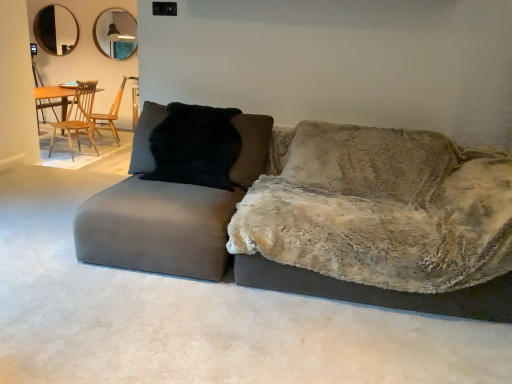
Question: In which direction should I rotate to look at wooden chair at center, the first chair from the back?

Choices:
 (A) left
 (B) right

Answer: (A)

Question: Considering the relative positions of matte silver mirror at upper center, the 1th mirror in the right-to-left sequence, and velvet gray couch at center in the image provided, is matte silver mirror at upper center, the 1th mirror in the right-to-left sequence, in front of velvet gray couch at center?

Choices:
 (A) no
 (B) yes

Answer: (A)

Question: Is matte silver mirror at upper center, arranged as the 2th mirror when viewed from the left, to the left of velvet gray couch at center from the viewer's perspective?

Choices:
 (A) no
 (B) yes

Answer: (B)

Question: Does matte silver mirror at upper center, arranged as the 2th mirror when viewed from the left, have a lesser height compared to velvet gray couch at center?

Choices:
 (A) no
 (B) yes

Answer: (A)

Question: Is matte silver mirror at upper center, arranged as the 2th mirror when viewed from the left, turned away from velvet gray couch at center?

Choices:
 (A) no
 (B) yes

Answer: (A)

Question: From the image's perspective, does matte silver mirror at upper center, arranged as the 2th mirror when viewed from the left, appear higher than velvet gray couch at center?

Choices:
 (A) no
 (B) yes

Answer: (B)

Question: Are matte silver mirror at upper center, arranged as the 2th mirror when viewed from the left, and velvet gray couch at center far apart?

Choices:
 (A) no
 (B) yes

Answer: (B)

Question: Does black glass mirror at upper left, the 2th mirror when ordered from right to left, have a lesser width compared to matte gray swivel chair at left?

Choices:
 (A) yes
 (B) no

Answer: (A)

Question: Is black glass mirror at upper left, the 2th mirror when ordered from right to left, beside matte gray swivel chair at left?

Choices:
 (A) no
 (B) yes

Answer: (A)

Question: Considering the relative positions of black glass mirror at upper left, the 2th mirror when ordered from right to left, and matte gray swivel chair at left in the image provided, is black glass mirror at upper left, the 2th mirror when ordered from right to left, to the right of matte gray swivel chair at left from the viewer's perspective?

Choices:
 (A) yes
 (B) no

Answer: (B)

Question: Would you say black glass mirror at upper left, the 2th mirror when ordered from right to left, is outside matte gray swivel chair at left?

Choices:
 (A) no
 (B) yes

Answer: (B)

Question: Is black glass mirror at upper left, the 2th mirror when ordered from right to left, oriented away from matte gray swivel chair at left?

Choices:
 (A) yes
 (B) no

Answer: (B)

Question: From the image's perspective, does black glass mirror at upper left, the 2th mirror when ordered from right to left, appear higher than matte gray swivel chair at left?

Choices:
 (A) no
 (B) yes

Answer: (B)

Question: Considering the relative positions of velvet gray couch at center and wooden chair at left, marked as the second chair in a back-to-front arrangement, in the image provided, is velvet gray couch at center behind wooden chair at left, marked as the second chair in a back-to-front arrangement,?

Choices:
 (A) yes
 (B) no

Answer: (B)